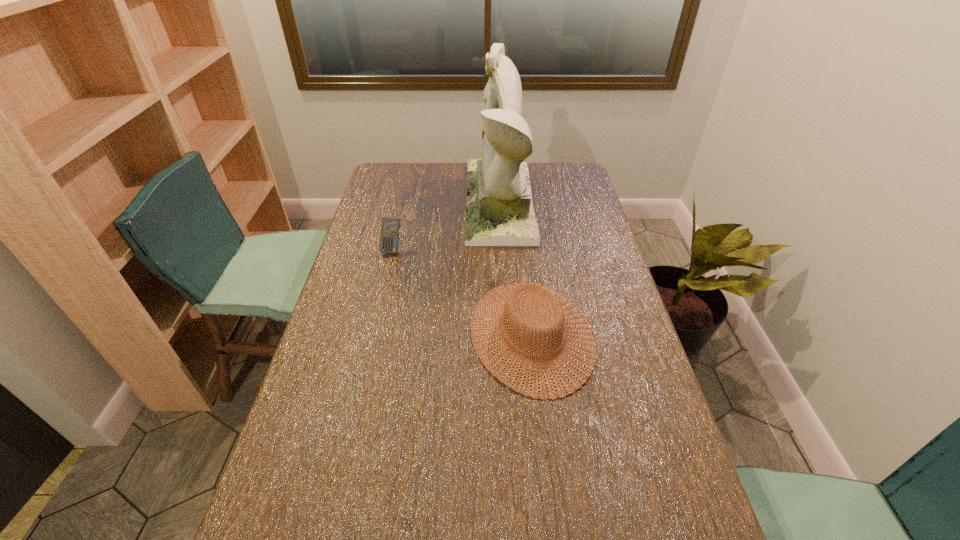
You are a GUI agent. You are given a task and a screenshot of the screen. Output one action in this format:
    pyautogui.click(x=<x>, y=<y>)
    Task: Click on the object present at the right edge
    
    Given the screenshot: What is the action you would take?
    pyautogui.click(x=549, y=304)

Where is `vacant space at the far edge of the desktop`? The height and width of the screenshot is (540, 960). vacant space at the far edge of the desktop is located at coordinates (439, 170).

This screenshot has height=540, width=960. Identify the location of vacant area at the left edge of the desktop. (347, 362).

Locate an element on the screen. This screenshot has width=960, height=540. free space at the right edge is located at coordinates (588, 305).

At what (x,y) coordinates should I click in order to perform the action: click on empty location between the nearest object and the tallest object. Please return your answer as a coordinate pair (x, y). Looking at the image, I should click on (516, 268).

Find the location of a particular element. free space between the leftmost object and the nearest object is located at coordinates (462, 292).

You are a GUI agent. You are given a task and a screenshot of the screen. Output one action in this format:
    pyautogui.click(x=<x>, y=<y>)
    Task: Click on the free spot between the sculpture and the sunhat
    The width and height of the screenshot is (960, 540).
    Given the screenshot: What is the action you would take?
    pyautogui.click(x=516, y=268)

You are a GUI agent. You are given a task and a screenshot of the screen. Output one action in this format:
    pyautogui.click(x=<x>, y=<y>)
    Task: Click on the unoccupied position between the calculator and the sculpture
    
    Given the screenshot: What is the action you would take?
    pyautogui.click(x=445, y=226)

The width and height of the screenshot is (960, 540). In order to click on vacant space that is in between the calculator and the sculpture in this screenshot , I will do `click(445, 226)`.

Locate an element on the screen. The height and width of the screenshot is (540, 960). vacant area between the calculator and the sculpture is located at coordinates (445, 226).